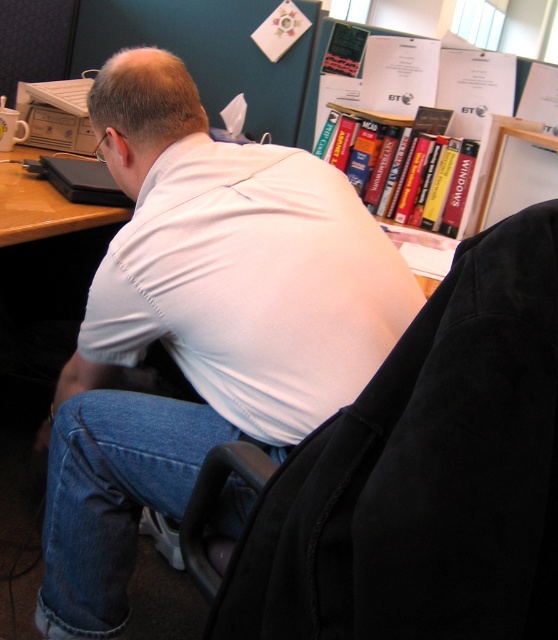
Question: Which of the following is the closest to the observer?

Choices:
 (A) (469, 356)
 (B) (277, 326)

Answer: (A)

Question: Among these points, which one is farthest from the camera?

Choices:
 (A) (277, 234)
 (B) (249, 636)

Answer: (A)

Question: Which point is closer to the camera taking this photo?

Choices:
 (A) (263, 545)
 (B) (66, 612)

Answer: (A)

Question: Is white matte shirt at upper center behind black fabric swivel chair at center?

Choices:
 (A) yes
 (B) no

Answer: (A)

Question: Is white matte shirt at upper center behind black fabric swivel chair at center?

Choices:
 (A) no
 (B) yes

Answer: (B)

Question: Is white matte shirt at upper center to the left of black fabric swivel chair at center from the viewer's perspective?

Choices:
 (A) yes
 (B) no

Answer: (A)